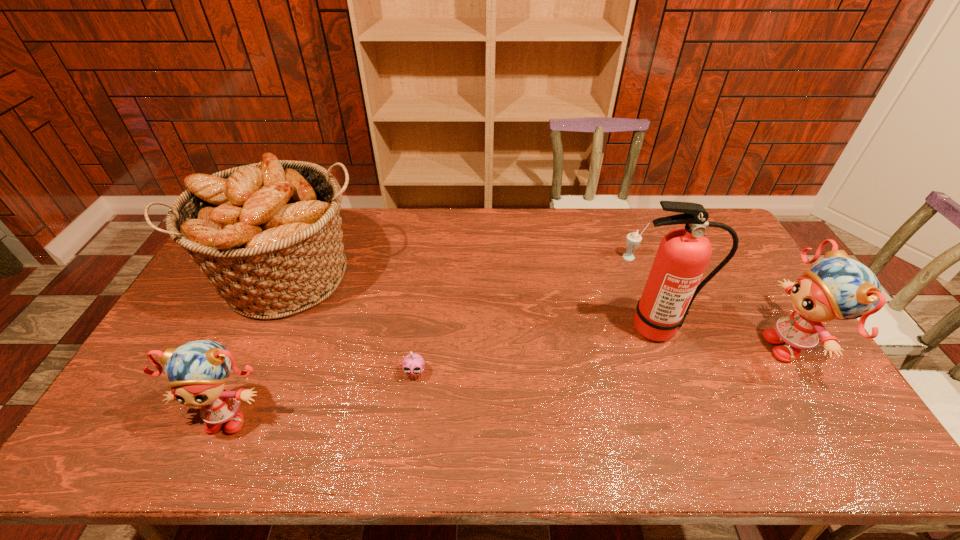
If equal spacing is the goal by inserting an additional doll among them, please point out a vacant space for this new doll. Please provide its 2D coordinates. Your answer should be formatted as a tuple, i.e. [(x, y)], where the tuple contains the x and y coordinates of a point satisfying the conditions above.

[(529, 377)]